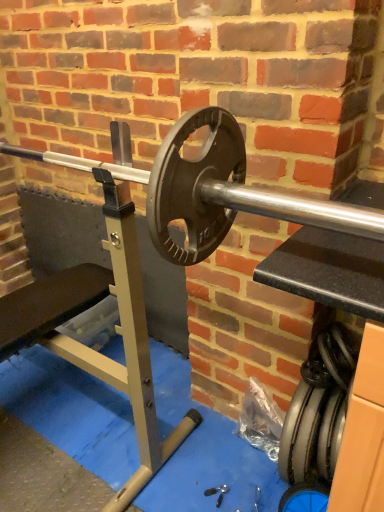
Question: Could rubber/smooth tire at lower right be considered to be inside polished silver barbell at center?

Choices:
 (A) yes
 (B) no

Answer: (B)

Question: From a real-world perspective, is polished silver barbell at center located higher than rubber/smooth tire at lower right?

Choices:
 (A) yes
 (B) no

Answer: (A)

Question: Does polished silver barbell at center have a greater height compared to rubber/smooth tire at lower right?

Choices:
 (A) no
 (B) yes

Answer: (A)

Question: Does polished silver barbell at center have a smaller size compared to rubber/smooth tire at lower right?

Choices:
 (A) no
 (B) yes

Answer: (A)

Question: Would you say polished silver barbell at center is a long distance from rubber/smooth tire at lower right?

Choices:
 (A) yes
 (B) no

Answer: (B)

Question: Is polished silver barbell at center wider than rubber/smooth tire at lower right?

Choices:
 (A) yes
 (B) no

Answer: (A)

Question: Is rubber/smooth tire at lower right smaller than polished silver barbell at center?

Choices:
 (A) yes
 (B) no

Answer: (A)

Question: From a real-world perspective, is rubber/smooth tire at lower right located beneath polished silver barbell at center?

Choices:
 (A) yes
 (B) no

Answer: (A)

Question: Is the position of rubber/smooth tire at lower right less distant than that of polished silver barbell at center?

Choices:
 (A) no
 (B) yes

Answer: (A)

Question: Are rubber/smooth tire at lower right and polished silver barbell at center making contact?

Choices:
 (A) no
 (B) yes

Answer: (A)

Question: From the image's perspective, is rubber/smooth tire at lower right on polished silver barbell at center?

Choices:
 (A) no
 (B) yes

Answer: (A)

Question: Is rubber/smooth tire at lower right wider than polished silver barbell at center?

Choices:
 (A) yes
 (B) no

Answer: (B)

Question: Is rubber/smooth tire at lower right to the left or to the right of polished silver barbell at center in the image?

Choices:
 (A) left
 (B) right

Answer: (B)